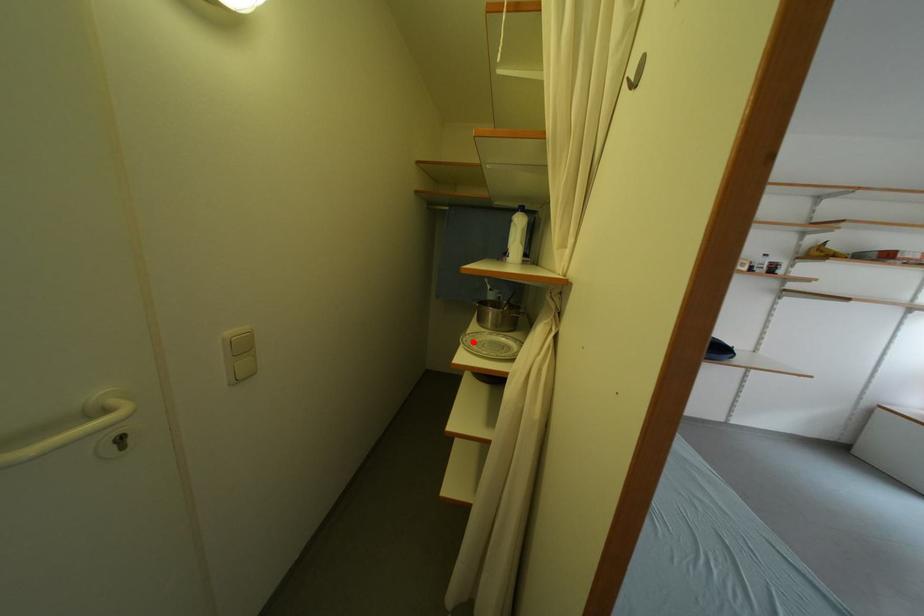
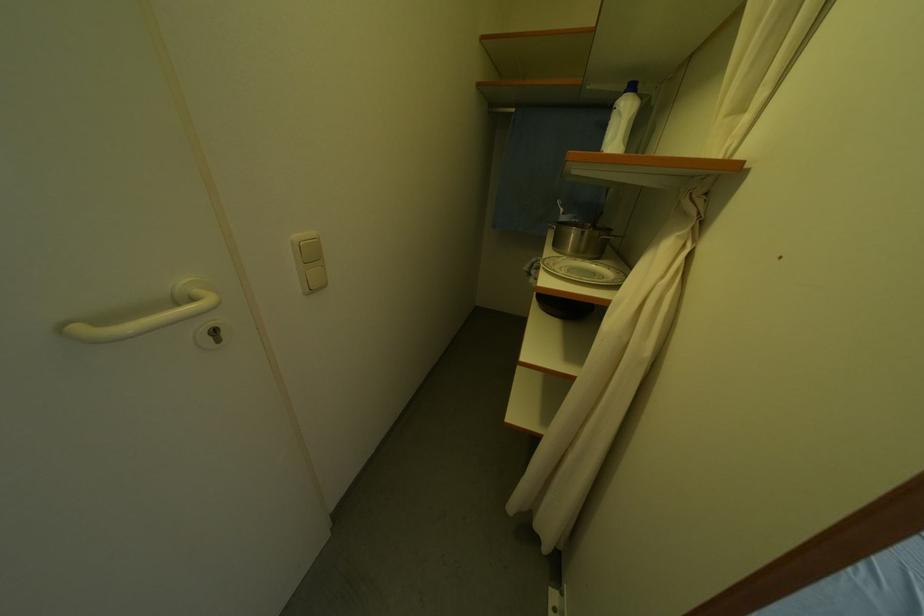
Question: I am providing you with two images of the same scene from different viewpoints. In image1, a red point is highlighted. Considering the same 3D point in image2, which of the following is correct?

Choices:
 (A) It is closer
 (B) It is farther

Answer: (A)